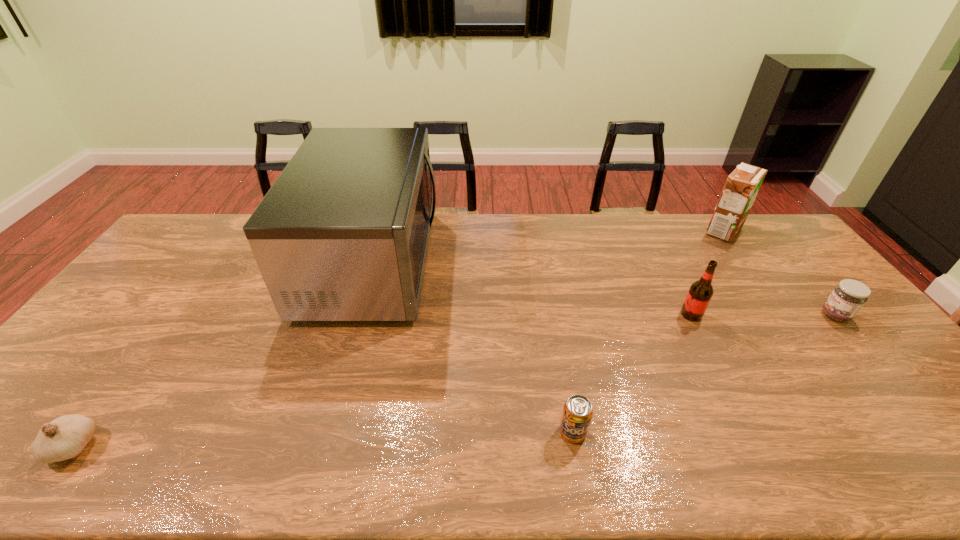
This screenshot has height=540, width=960. In order to click on vacant space at the right edge of the desktop in this screenshot , I will do `click(828, 319)`.

At what (x,y) coordinates should I click in order to perform the action: click on vacant area at the near left corner of the desktop. Please return your answer as a coordinate pair (x, y). The width and height of the screenshot is (960, 540). Looking at the image, I should click on (26, 479).

This screenshot has width=960, height=540. Find the location of `free space at the far right corner of the desktop`. free space at the far right corner of the desktop is located at coordinates (749, 220).

Locate an element on the screen. vacant area between the leftmost object and the third object from left to right is located at coordinates (324, 439).

The image size is (960, 540). In order to click on free space between the garlic and the fourth shortest object in this screenshot , I will do `click(382, 380)`.

Where is `vacant space that's between the root beer and the second object from left to right`? This screenshot has width=960, height=540. vacant space that's between the root beer and the second object from left to right is located at coordinates (532, 288).

Identify the location of empty location between the third object from left to right and the leftmost object. (324, 439).

Find the location of `free space between the fifth shortest object and the jam`. free space between the fifth shortest object and the jam is located at coordinates (780, 273).

The width and height of the screenshot is (960, 540). In order to click on unoccupied area between the fifth shortest object and the rightmost object in this screenshot , I will do `click(780, 273)`.

Where is `unoccupied position between the leftmost object and the jam`? This screenshot has height=540, width=960. unoccupied position between the leftmost object and the jam is located at coordinates (454, 381).